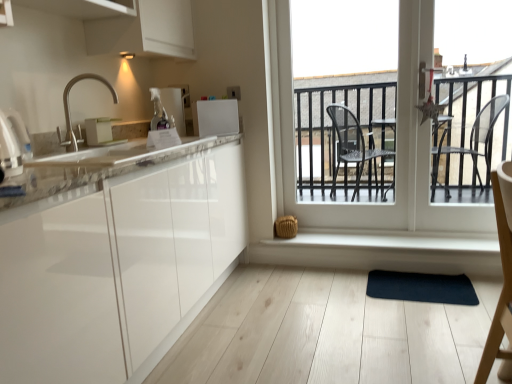
Locate an element on the screen. blank area to the left of dark blue rubber yoga mat at center is located at coordinates pyautogui.click(x=339, y=300).